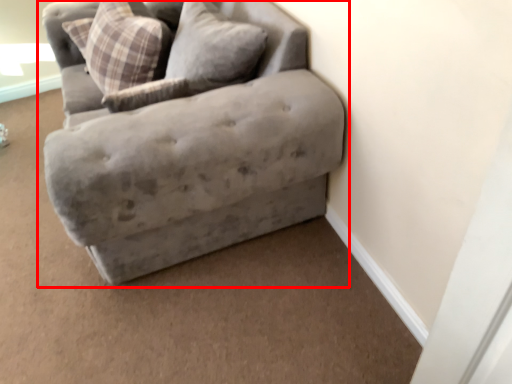
Question: From the image's perspective, considering the relative positions of studio couch (annotated by the red box) and pillow in the image provided, where is studio couch (annotated by the red box) located with respect to the staircase?

Choices:
 (A) below
 (B) above

Answer: (A)